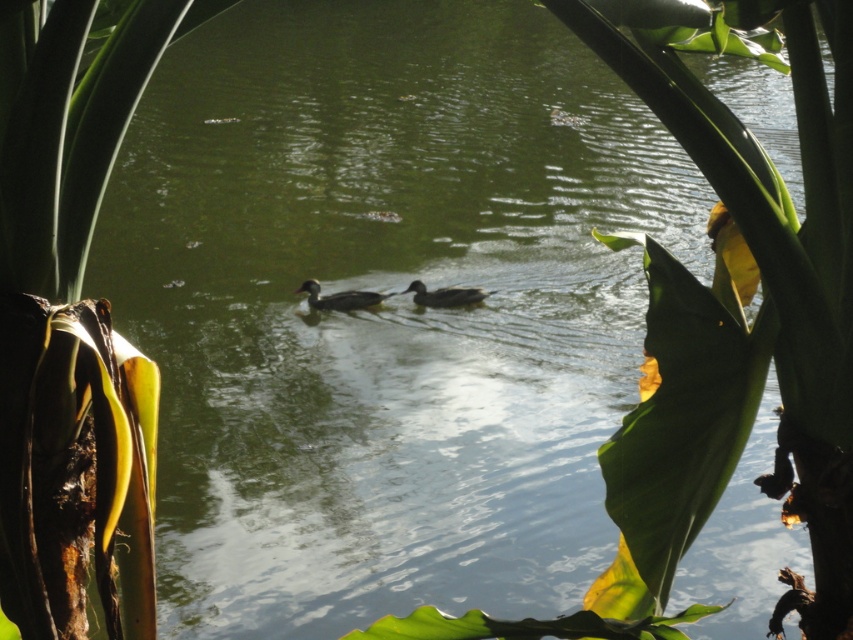
Is dark brown glossy duck at center shorter than dark gray matte duck at center?

No.

Between dark brown glossy duck at center and dark gray matte duck at center, which one appears on the right side from the viewer's perspective?

dark gray matte duck at center

Does point (325, 307) come farther from viewer compared to point (436, 300)?

Yes, it is behind point (436, 300).

Locate an element on the screen. The width and height of the screenshot is (853, 640). dark brown glossy duck at center is located at coordinates (340, 298).